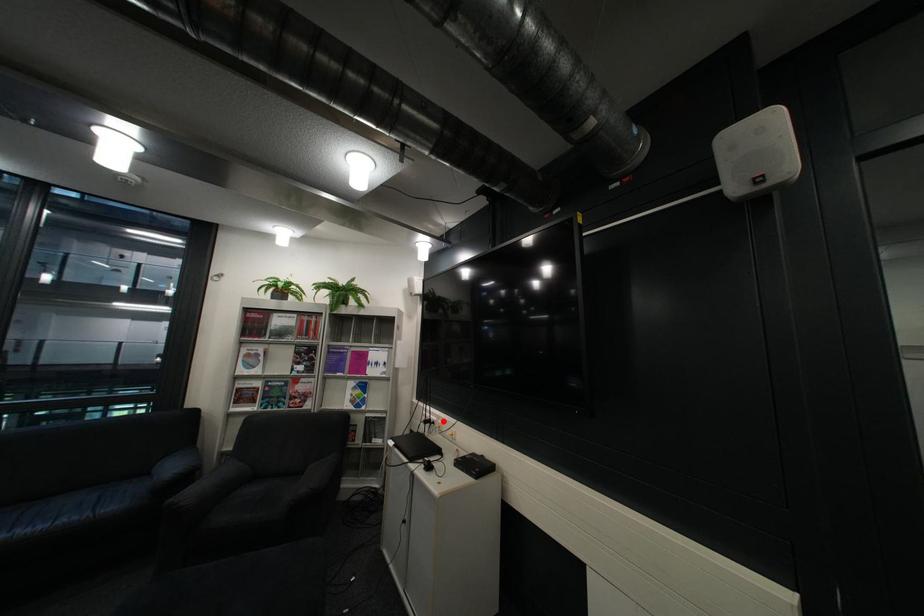
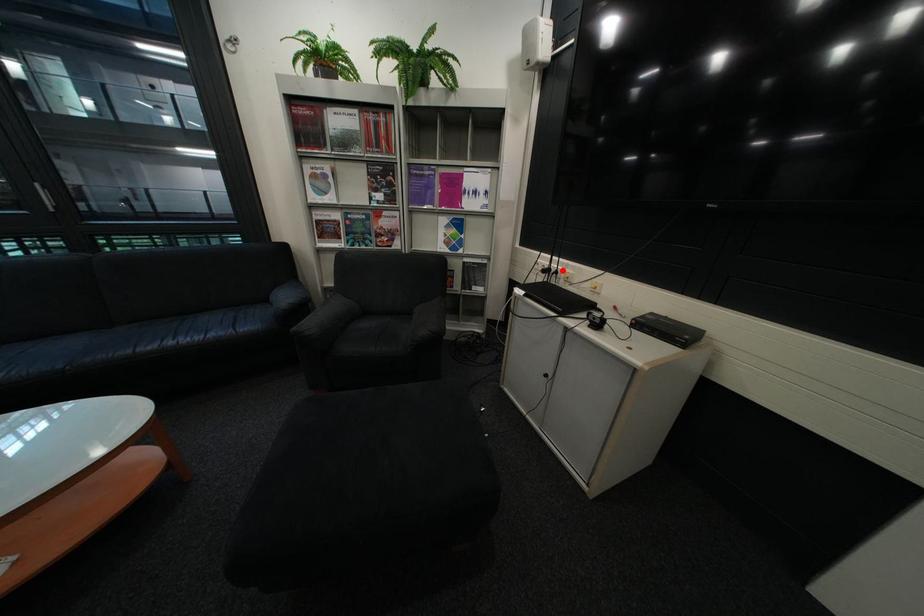
I am providing you with two images of the same scene from different viewpoints. A red point is marked on the first image and another point is marked on the second image. Does the point marked in image1 correspond to the same location as the one in image2?

Yes